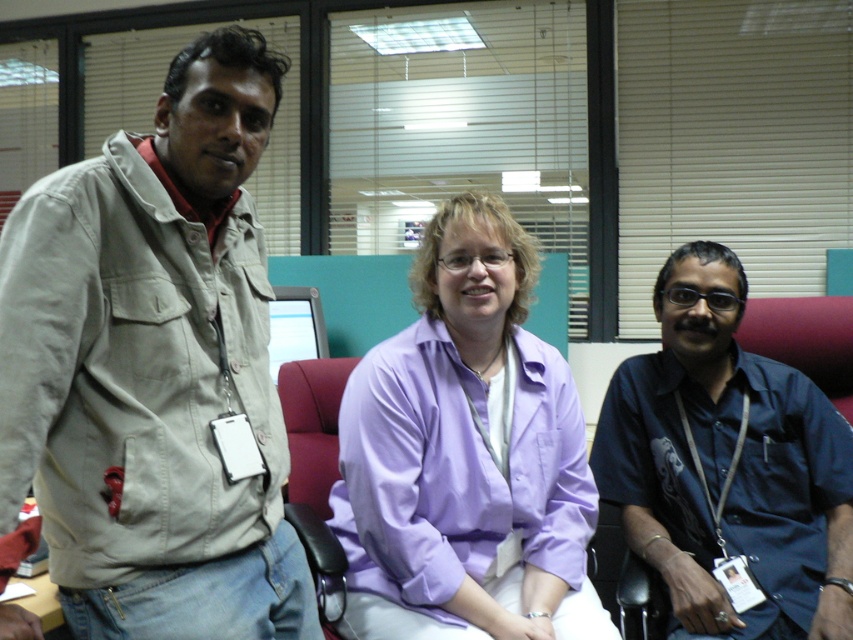
The image size is (853, 640). What do you see at coordinates (155, 369) in the screenshot?
I see `beige cotton jacket at left` at bounding box center [155, 369].

Find the location of a particular element. The width and height of the screenshot is (853, 640). beige cotton jacket at left is located at coordinates (155, 369).

Locate an element on the screen. The width and height of the screenshot is (853, 640). beige cotton jacket at left is located at coordinates (155, 369).

Consider the image. Does beige cotton jacket at left have a smaller size compared to dark blue shirt at center?

Yes.

Is beige cotton jacket at left to the left of dark blue shirt at center from the viewer's perspective?

Correct, you'll find beige cotton jacket at left to the left of dark blue shirt at center.

What do you see at coordinates (155, 369) in the screenshot? I see `beige cotton jacket at left` at bounding box center [155, 369].

Where is `beige cotton jacket at left`? beige cotton jacket at left is located at coordinates (155, 369).

Between purple cotton shirt at center and dark blue shirt at center, which one is positioned lower?

dark blue shirt at center

What are the coordinates of `purple cotton shirt at center` in the screenshot? It's located at (466, 456).

Where is `purple cotton shirt at center`? The width and height of the screenshot is (853, 640). purple cotton shirt at center is located at coordinates (466, 456).